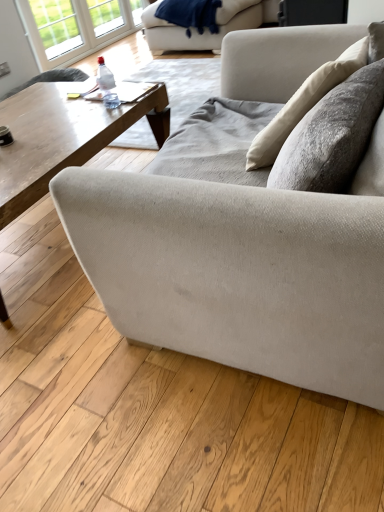
Question: Are beige fabric couch at upper center, placed as the first studio couch when sorted from back to front, and wooden coffee table at center making contact?

Choices:
 (A) no
 (B) yes

Answer: (A)

Question: Is beige fabric couch at upper center, the first studio couch in the top-to-bottom sequence, to the left of wooden coffee table at center from the viewer's perspective?

Choices:
 (A) no
 (B) yes

Answer: (A)

Question: Is beige fabric couch at upper center, which ranks as the second studio couch in bottom-to-top order, further to camera compared to wooden coffee table at center?

Choices:
 (A) no
 (B) yes

Answer: (B)

Question: Considering the relative sizes of beige fabric couch at upper center, the first studio couch in the top-to-bottom sequence, and wooden coffee table at center in the image provided, is beige fabric couch at upper center, the first studio couch in the top-to-bottom sequence, taller than wooden coffee table at center?

Choices:
 (A) yes
 (B) no

Answer: (A)

Question: Would you say beige fabric couch at upper center, which ranks as the second studio couch in bottom-to-top order, is outside wooden coffee table at center?

Choices:
 (A) no
 (B) yes

Answer: (B)

Question: Is beige fabric couch at upper center, which ranks as the second studio couch in bottom-to-top order, in front of wooden coffee table at center?

Choices:
 (A) yes
 (B) no

Answer: (B)

Question: Is beige fabric couch at upper center, placed as the first studio couch when sorted from back to front, further to camera compared to velvety blue blanket at upper center?

Choices:
 (A) yes
 (B) no

Answer: (A)

Question: Is beige fabric couch at upper center, placed as the first studio couch when sorted from back to front, facing away from velvety blue blanket at upper center?

Choices:
 (A) yes
 (B) no

Answer: (A)

Question: Is beige fabric couch at upper center, placed as the first studio couch when sorted from back to front, shorter than velvety blue blanket at upper center?

Choices:
 (A) yes
 (B) no

Answer: (B)

Question: Is beige fabric couch at upper center, the second studio couch positioned from the front, to the left of velvety blue blanket at upper center from the viewer's perspective?

Choices:
 (A) no
 (B) yes

Answer: (A)

Question: From a real-world perspective, does beige fabric couch at upper center, the second studio couch positioned from the front, sit lower than velvety blue blanket at upper center?

Choices:
 (A) no
 (B) yes

Answer: (B)

Question: Does beige fabric couch at upper center, placed as the first studio couch when sorted from back to front, touch velvety blue blanket at upper center?

Choices:
 (A) yes
 (B) no

Answer: (B)

Question: From the image's perspective, is white glass window at upper left, which is the 2th window in left-to-right order, located beneath wooden coffee table at center?

Choices:
 (A) no
 (B) yes

Answer: (A)